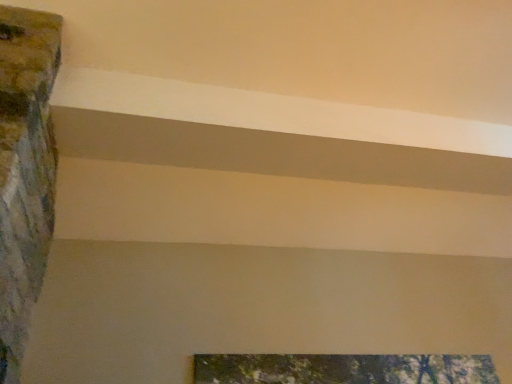
The image size is (512, 384). What do you see at coordinates (343, 369) in the screenshot?
I see `textured green oil painting at lower center` at bounding box center [343, 369].

The height and width of the screenshot is (384, 512). In order to click on textured green oil painting at lower center in this screenshot , I will do `click(343, 369)`.

Measure the distance between point [428,382] and camera.

They are 2.57 meters apart.

Locate an element on the screen. textured green oil painting at lower center is located at coordinates (343, 369).